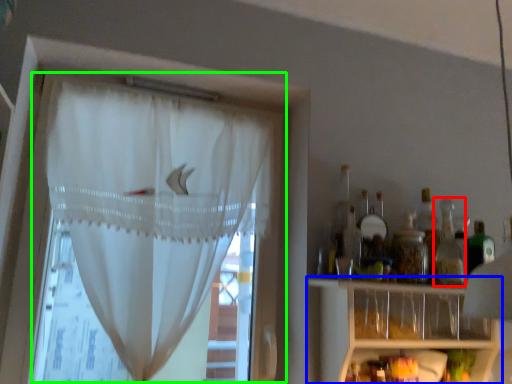
Question: Based on their relative distances, which object is farther from bottle (highlighted by a red box)? Choose from shelf (highlighted by a blue box) and curtain (highlighted by a green box).

Choices:
 (A) shelf
 (B) curtain

Answer: (B)